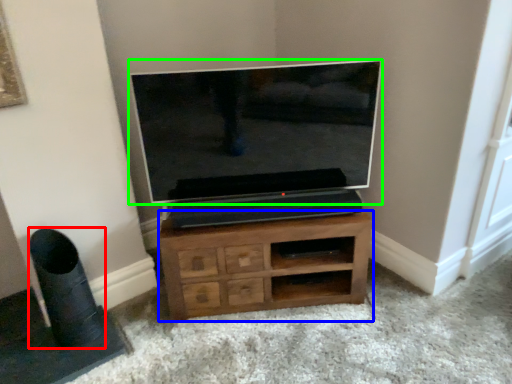
Question: Considering the real-world distances, which object is farthest from speaker (highlighted by a red box)? chest of drawers (highlighted by a blue box) or television (highlighted by a green box)?

Choices:
 (A) chest of drawers
 (B) television

Answer: (B)